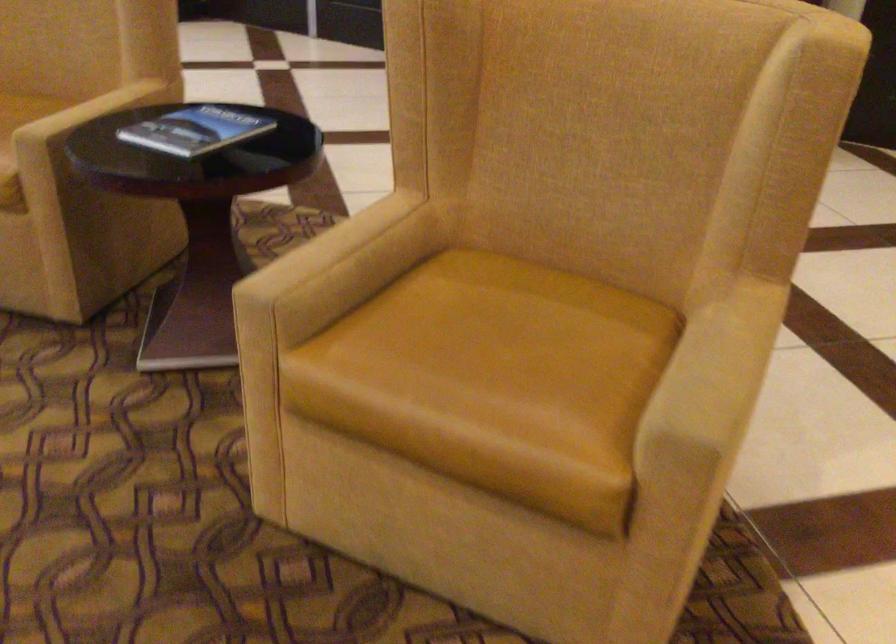
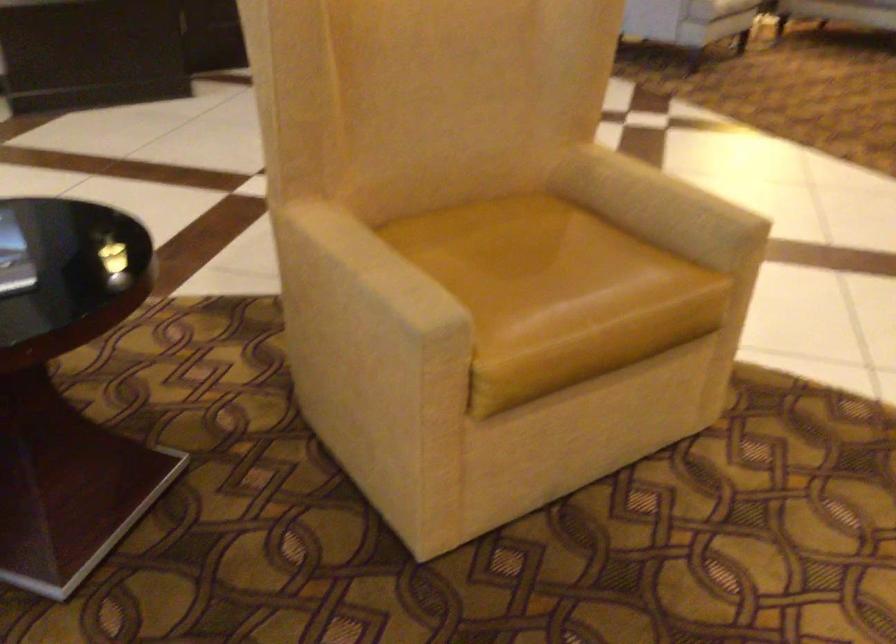
In the second image, find the point that corresponds to [691,364] in the first image.

(659, 205)